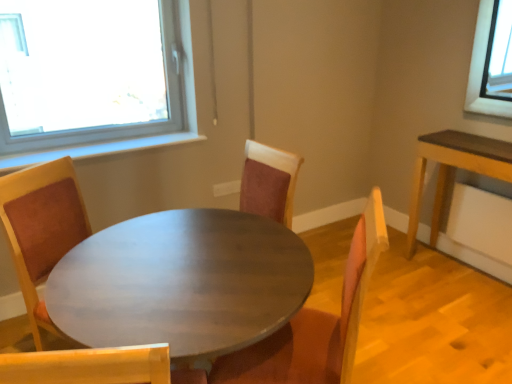
Question: Is suede-like brown chair at center inside or outside of matte wood table at center?

Choices:
 (A) inside
 (B) outside

Answer: (A)

Question: Is suede-like brown chair at center in front of or behind matte wood table at center in the image?

Choices:
 (A) behind
 (B) front

Answer: (A)

Question: From a real-world perspective, is suede-like brown chair at center positioned above or below matte wood table at center?

Choices:
 (A) above
 (B) below

Answer: (A)

Question: Would you say matte wood table at center is to the left or to the right of suede-like brown chair at center in the picture?

Choices:
 (A) right
 (B) left

Answer: (B)

Question: Considering the positions of matte wood table at center and suede-like brown chair at center in the image, is matte wood table at center taller or shorter than suede-like brown chair at center?

Choices:
 (A) tall
 (B) short

Answer: (B)

Question: Choose the correct answer: Is matte wood table at center inside suede-like brown chair at center or outside it?

Choices:
 (A) outside
 (B) inside

Answer: (A)

Question: From the image's perspective, is matte wood table at center positioned above or below suede-like brown chair at center?

Choices:
 (A) below
 (B) above

Answer: (A)